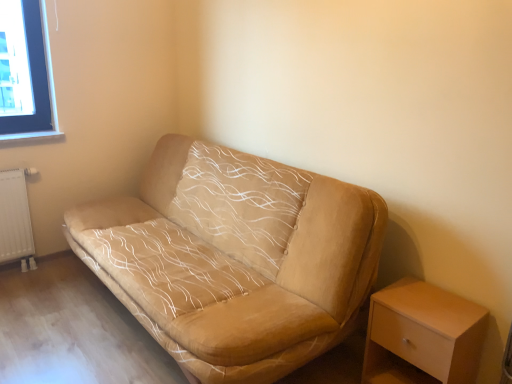
The width and height of the screenshot is (512, 384). I want to click on vacant region to the right of white textured radiator at lower left, so click(x=55, y=271).